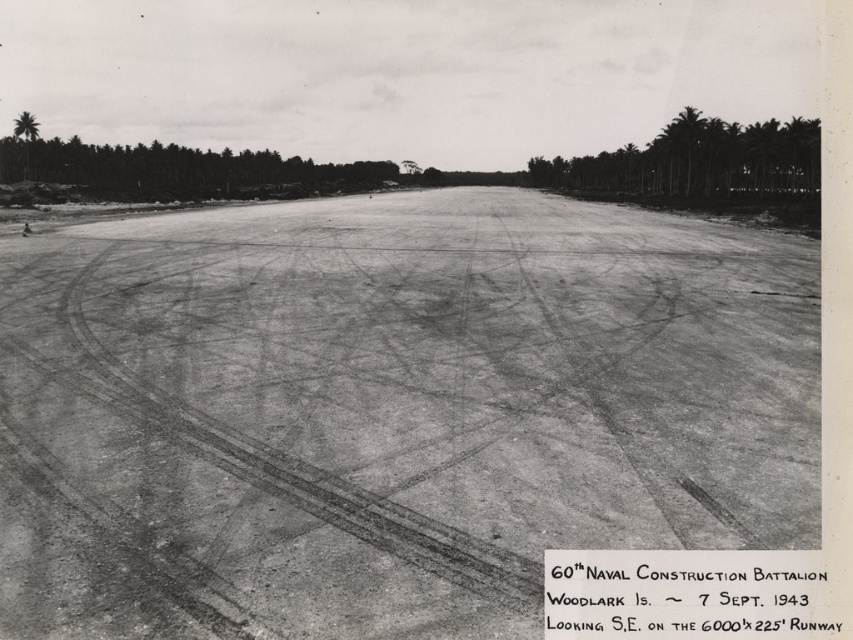
You are a pilot trying to land a small plane on the dirt at center of the airfield. There is a green leafy palm tree at upper left in your view. Which direction should you adjust your landing path to avoid the tree?

The dirt at center is positioned on the right side of the green leafy palm tree at upper left, so you should adjust your landing path to the right to avoid the tree.

You are a pilot trying to navigate an airplane to land on the airfield. You notice two landmarks in the distance for orientation. The first is the green leafy trees at upper right, and the second is the green leafy palm tree at upper left. Which of these landmarks is located to the right when viewed from your perspective?

The green leafy trees at upper right is positioned on the right side of green leafy palm tree at upper left, so the green leafy trees at upper right is located to the right when viewed from your perspective.

You are a pilot preparing to land a small aircraft on this airfield. You notice two points marked on your radar corresponding to coordinates point (434, 269) and point (688, 138). Which point is closer to your current position near the runway threshold?

Point (434, 269) is closer to the camera than point (688, 138), so the point (434, 269) is closer to your current position near the runway threshold.